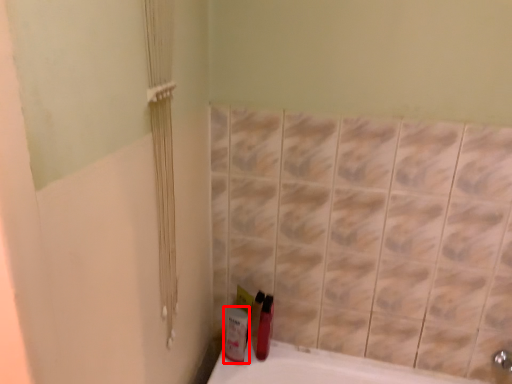
Question: From the image's perspective, what is the correct spatial positioning of mouthwash (annotated by the red box) in reference to mouthwash?

Choices:
 (A) above
 (B) below

Answer: (B)